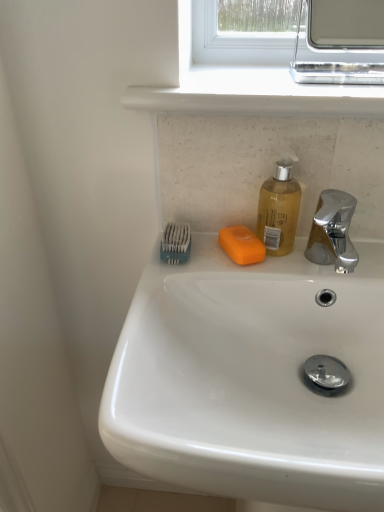
The width and height of the screenshot is (384, 512). Find the location of `orange matte soap at center`. orange matte soap at center is located at coordinates (241, 245).

At what (x,y) coordinates should I click in order to perform the action: click on white smooth window sill at upper center. Please return your answer as a coordinate pair (x, y). The height and width of the screenshot is (512, 384). Looking at the image, I should click on (258, 97).

Measure the distance between chrome metallic medicine cabinet at upper right and camera.

chrome metallic medicine cabinet at upper right and camera are 4.87 feet apart from each other.

Image resolution: width=384 pixels, height=512 pixels. In order to click on translucent yellow liquid at upper center in this screenshot , I will do `click(278, 210)`.

Is orange matte soap at center taller than white smooth window sill at upper center?

In fact, orange matte soap at center may be shorter than white smooth window sill at upper center.

Which is nearer, [239,227] or [379,87]?

The point [379,87] is more forward.

What's the angular difference between orange matte soap at center and white smooth window sill at upper center's facing directions?

orange matte soap at center and white smooth window sill at upper center are facing 19.5 degrees away from each other.

How far apart are orange matte soap at center and white smooth window sill at upper center?

orange matte soap at center and white smooth window sill at upper center are 8.56 inches apart.

From the image's perspective, which one is positioned higher, white smooth window sill at upper center or orange matte soap at center?

white smooth window sill at upper center appears higher in the image.

Which object is thinner, white smooth window sill at upper center or orange matte soap at center?

With smaller width is orange matte soap at center.

Considering the sizes of objects white smooth window sill at upper center and orange matte soap at center in the image provided, who is shorter, white smooth window sill at upper center or orange matte soap at center?

With less height is orange matte soap at center.

Which is closer, (372, 110) or (229, 239)?

Point (372, 110).

Considering the relative sizes of translucent yellow liquid at upper center and white glossy sink at center in the image provided, is translucent yellow liquid at upper center wider than white glossy sink at center?

No.

Is the depth of translucent yellow liquid at upper center greater than that of white glossy sink at center?

Yes, translucent yellow liquid at upper center is behind white glossy sink at center.

From the image's perspective, relative to white glossy sink at center, is translucent yellow liquid at upper center above or below?

Based on their image positions, translucent yellow liquid at upper center is located above white glossy sink at center.

Is translucent yellow liquid at upper center oriented away from white glossy sink at center?

No, white glossy sink at center is not at the back of translucent yellow liquid at upper center.

Which object is wider, blue plastic toothbrush at upper left or orange matte soap at center?

With larger width is orange matte soap at center.

Is blue plastic toothbrush at upper left far away from orange matte soap at center?

No, blue plastic toothbrush at upper left is not far away from orange matte soap at center.

The height and width of the screenshot is (512, 384). In order to click on soap located below the blue plastic toothbrush at upper left (from the image's perspective) in this screenshot , I will do `click(241, 245)`.

Which object is further away from the camera taking this photo, blue plastic toothbrush at upper left or orange matte soap at center?

blue plastic toothbrush at upper left is behind.

The height and width of the screenshot is (512, 384). Find the location of `sink located underneath the orange matte soap at center (from a real-world perspective)`. sink located underneath the orange matte soap at center (from a real-world perspective) is located at coordinates (256, 372).

Does white glossy sink at center appear on the left side of orange matte soap at center?

In fact, white glossy sink at center is to the right of orange matte soap at center.

Does white glossy sink at center turn towards orange matte soap at center?

No, white glossy sink at center is not oriented towards orange matte soap at center.

Is white glossy sink at center bigger than chrome metallic medicine cabinet at upper right?

Correct, white glossy sink at center is larger in size than chrome metallic medicine cabinet at upper right.

From the image's perspective, who appears lower, white glossy sink at center or chrome metallic medicine cabinet at upper right?

white glossy sink at center is shown below in the image.

Which object is positioned more to the left, white glossy sink at center or chrome metallic medicine cabinet at upper right?

From the viewer's perspective, white glossy sink at center appears more on the left side.

Considering the relative sizes of white glossy sink at center and chrome metallic medicine cabinet at upper right in the image provided, is white glossy sink at center wider than chrome metallic medicine cabinet at upper right?

Indeed, white glossy sink at center has a greater width compared to chrome metallic medicine cabinet at upper right.

Which is behind, blue plastic toothbrush at upper left or white glossy sink at center?

blue plastic toothbrush at upper left is behind.

Who is smaller, blue plastic toothbrush at upper left or white glossy sink at center?

blue plastic toothbrush at upper left is smaller.

Where is `soap below the white smooth window sill at upper center (from a real-world perspective)`? The height and width of the screenshot is (512, 384). soap below the white smooth window sill at upper center (from a real-world perspective) is located at coordinates (241, 245).

This screenshot has width=384, height=512. Find the location of `soap below the white smooth window sill at upper center (from the image's perspective)`. soap below the white smooth window sill at upper center (from the image's perspective) is located at coordinates (241, 245).

When comparing their distances from orange matte soap at center, does blue plastic toothbrush at upper left or white glossy sink at center seem further?

white glossy sink at center.

Considering their positions, is translucent yellow liquid at upper center positioned further to chrome metallic medicine cabinet at upper right than white glossy sink at center?

Based on the image, white glossy sink at center appears to be further to chrome metallic medicine cabinet at upper right.

Considering their positions, is chrome metallic medicine cabinet at upper right positioned further to white glossy sink at center than blue plastic toothbrush at upper left?

chrome metallic medicine cabinet at upper right.

In the scene shown: Based on their spatial positions, is white smooth window sill at upper center or orange matte soap at center closer to translucent yellow liquid at upper center?

Based on the image, orange matte soap at center appears to be nearer to translucent yellow liquid at upper center.

Estimate the real-world distances between objects in this image. Which object is closer to chrome metallic medicine cabinet at upper right, orange matte soap at center or translucent yellow liquid at upper center?

translucent yellow liquid at upper center is positioned closer to the anchor chrome metallic medicine cabinet at upper right.

Looking at the image, which one is located closer to white glossy sink at center, orange matte soap at center or chrome metallic medicine cabinet at upper right?

The object closer to white glossy sink at center is orange matte soap at center.

Which object lies nearer to the anchor point translucent yellow liquid at upper center, orange matte soap at center or chrome metallic medicine cabinet at upper right?

The object closer to translucent yellow liquid at upper center is orange matte soap at center.

Considering their positions, is translucent yellow liquid at upper center positioned further to chrome metallic medicine cabinet at upper right than blue plastic toothbrush at upper left?

The object further to chrome metallic medicine cabinet at upper right is blue plastic toothbrush at upper left.

This screenshot has width=384, height=512. I want to click on scrubbing brush between white smooth window sill at upper center and orange matte soap at center in the vertical direction, so click(x=175, y=243).

At what (x,y) coordinates should I click in order to perform the action: click on soap dispenser between chrome metallic medicine cabinet at upper right and blue plastic toothbrush at upper left vertically. Please return your answer as a coordinate pair (x, y). Looking at the image, I should click on (278, 210).

The height and width of the screenshot is (512, 384). I want to click on scrubbing brush between chrome metallic medicine cabinet at upper right and orange matte soap at center vertically, so click(x=175, y=243).

Identify the location of soap dispenser between white smooth window sill at upper center and white glossy sink at center from top to bottom. This screenshot has height=512, width=384. (278, 210).